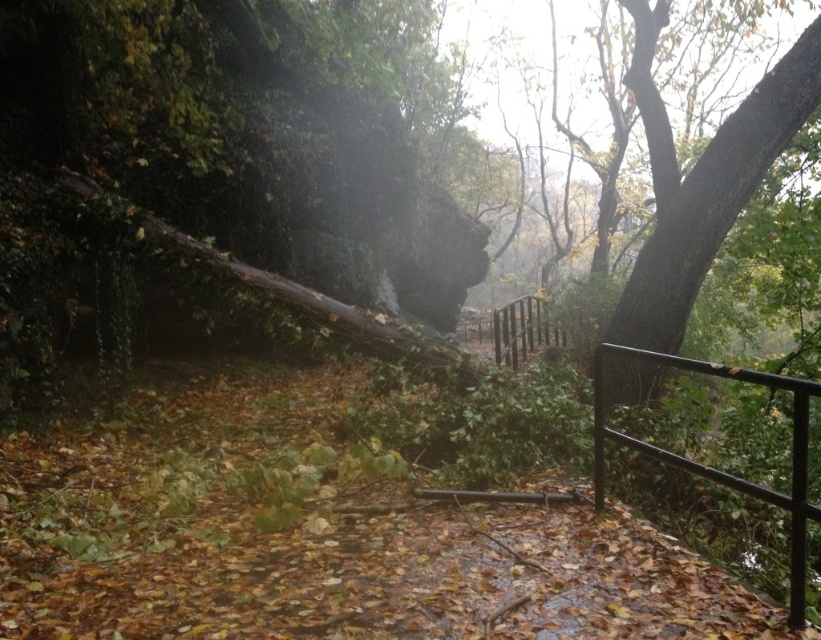
Does brown rough bark tree at upper right come in front of black metal fence at right?

No.

Is point (806, 96) farther from camera compared to point (645, 449)?

Yes, it is.

Does point (613, 320) lie in front of point (794, 474)?

No.

This screenshot has height=640, width=821. What are the coordinates of `brown rough bark tree at upper right` in the screenshot? It's located at (702, 180).